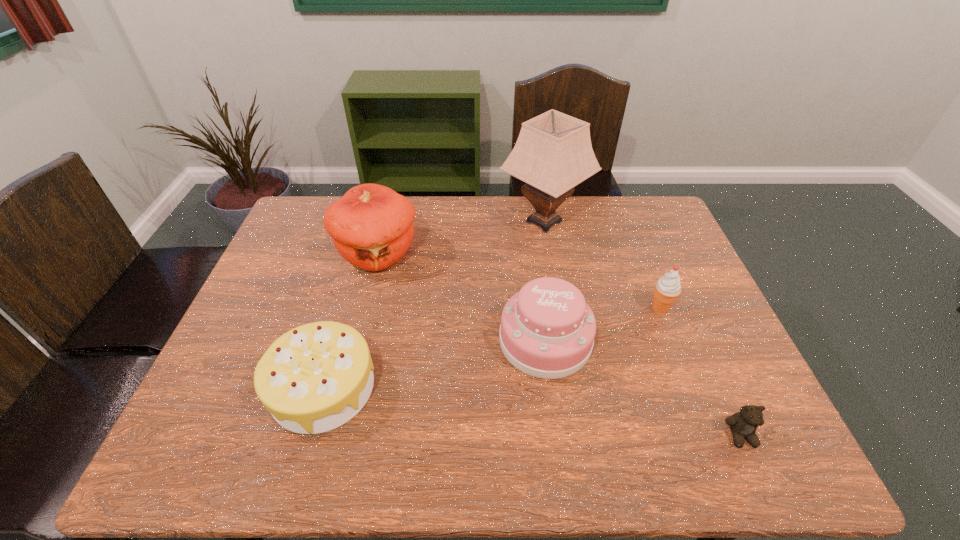
Find the location of a particular element. vacant space at the far edge of the desktop is located at coordinates (569, 199).

The width and height of the screenshot is (960, 540). Identify the location of vacant area at the near edge. (642, 449).

Image resolution: width=960 pixels, height=540 pixels. Identify the location of free space at the left edge of the desktop. (286, 285).

What are the coordinates of `vacant area at the right edge` in the screenshot? It's located at (677, 264).

Where is `free spot at the far left corner of the desktop`? The image size is (960, 540). free spot at the far left corner of the desktop is located at coordinates (316, 232).

This screenshot has height=540, width=960. In order to click on vacant space at the near left corner of the desktop in this screenshot , I will do `click(242, 448)`.

At what (x,y) coordinates should I click in order to perform the action: click on unoccupied position between the tallest object and the second tallest object. Please return your answer as a coordinate pair (x, y). Looking at the image, I should click on (461, 238).

Find the location of a particular element. Image resolution: width=960 pixels, height=540 pixels. vacant point located between the pumpkin and the icecream is located at coordinates (519, 281).

The image size is (960, 540). In order to click on vacant area that lies between the teddy bear and the icecream in this screenshot , I will do `click(700, 372)`.

I want to click on vacant area that lies between the lampshade and the icecream, so click(x=602, y=265).